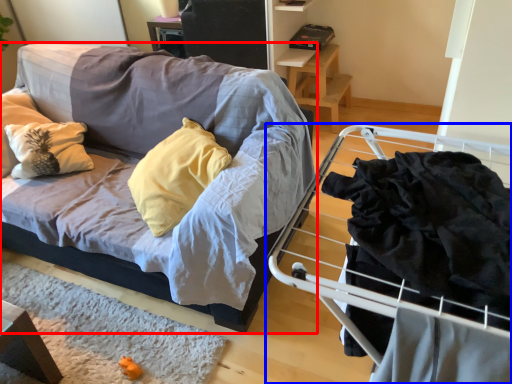
Question: Which of the following is the farthest to the observer, studio couch (highlighted by a red box) or furniture (highlighted by a blue box)?

Choices:
 (A) studio couch
 (B) furniture

Answer: (A)